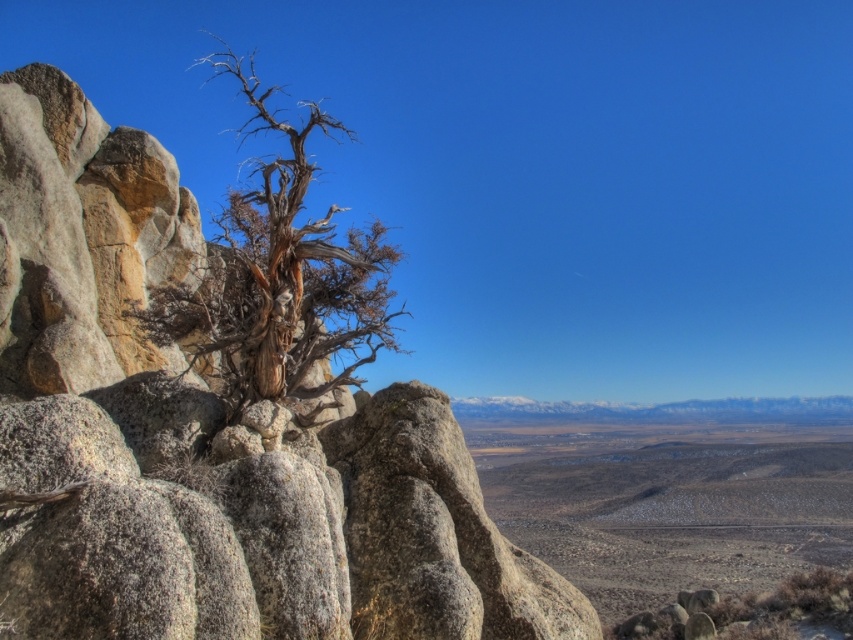
Which is above, desert soil at lower right or brown/dried wood tree at left?

brown/dried wood tree at left

Measure the distance between point (x=532, y=474) and camera.

Point (x=532, y=474) and camera are 179.08 meters apart from each other.

Find the location of a particular element. The height and width of the screenshot is (640, 853). desert soil at lower right is located at coordinates (670, 509).